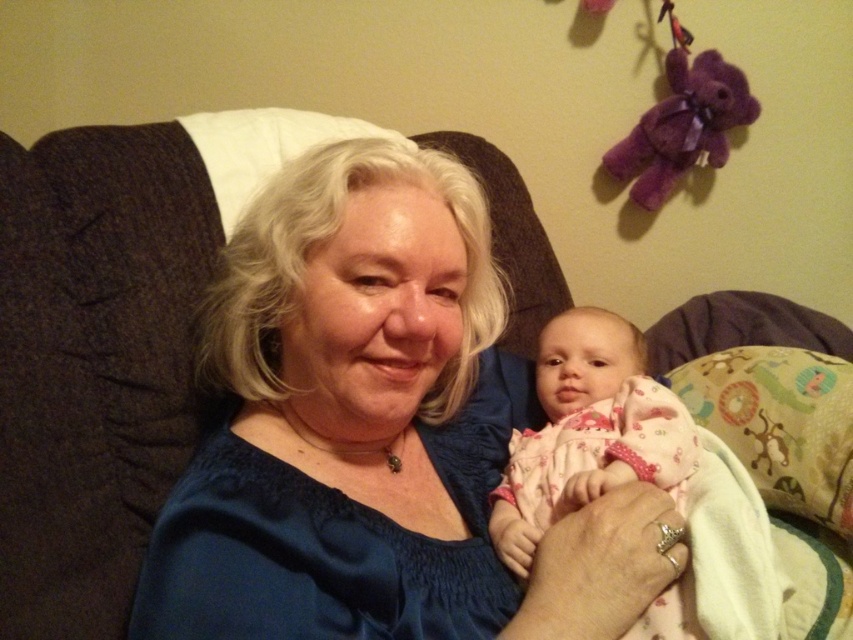
You are a photographer setting up for a portrait. You want to ensure the blue satin blouse at center is in focus. If your camera has a depth of field that can sharply capture objects within 15 inches from the current focus point, where should you focus to include the blouse?

You should focus at 18.90 inches from the camera, which is the exact distance of the blue satin blouse at center. This ensures the blouse will be in sharp focus since it falls within the camera depth of field range of 15 inches around the focus point.

You are a photographer trying to capture a closeup shot of both the blue satin blouse at center and the pink cotton baby at center. Since the camera can only focus on one subject at a time, which object should you prioritize to ensure it fills the frame adequately given their size difference?

The blue satin blouse at center has a larger width than the pink cotton baby at center, so prioritizing the blue satin blouse at center will ensure it fills the frame adequately.

You are a photographer taking a picture of the scene. The camera you are using has a focus range of 6 inches. Can you focus on both the blue satin blouse at center and the pink cotton baby at center at the same time?

The blue satin blouse at center and pink cotton baby at center are 5.78 inches apart from each other. Since the camera has a focus range of 6 inches, they can be focused on simultaneously.